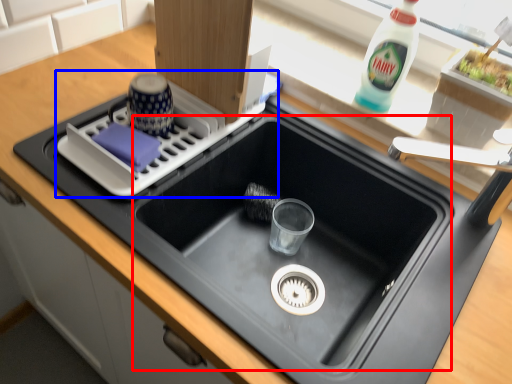
Question: Which of the following is the closest to the observer, sink (highlighted by a red box) or appliance (highlighted by a blue box)?

Choices:
 (A) sink
 (B) appliance

Answer: (A)